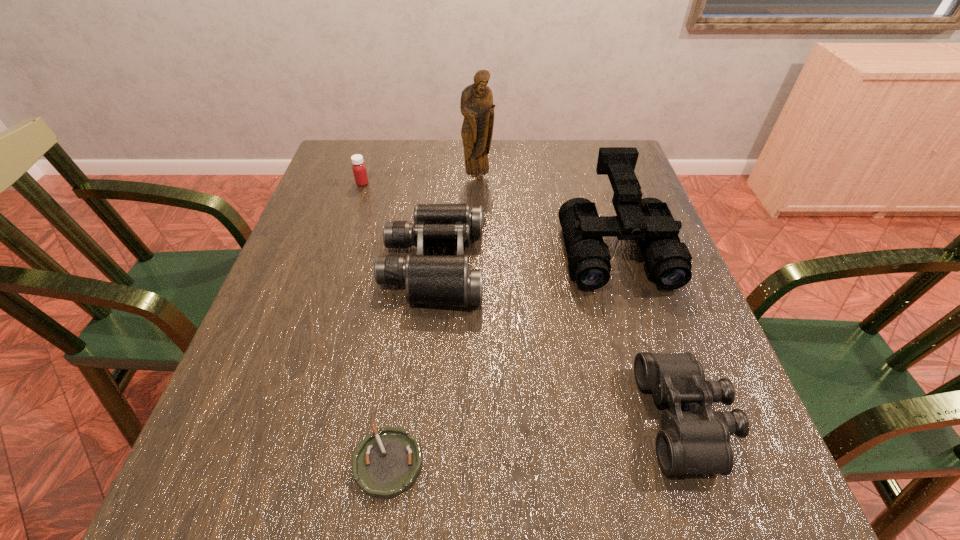
Locate an element on the screen. free point located on the right of the medicine is located at coordinates (478, 184).

Find the location of a particular element. This screenshot has width=960, height=540. free spot located 0.120m at the eyepieces of the nearest binoculars is located at coordinates (574, 418).

Find the location of `blank area located 0.340m at the eyepieces of the nearest binoculars`. blank area located 0.340m at the eyepieces of the nearest binoculars is located at coordinates (443, 418).

At what (x,y) coordinates should I click in order to perform the action: click on vacant space located 0.190m at the eyepieces of the nearest binoculars. Please return your answer as a coordinate pair (x, y). This screenshot has width=960, height=540. Looking at the image, I should click on (532, 418).

Where is `free space located on the right of the ashtray`? free space located on the right of the ashtray is located at coordinates (629, 463).

Where is `figurine located at the far edge`? figurine located at the far edge is located at coordinates (477, 107).

Find the location of a particular element. This screenshot has height=540, width=960. medicine at the far edge is located at coordinates (359, 169).

The image size is (960, 540). I want to click on binoculars at the near edge, so click(698, 442).

You are a GUI agent. You are given a task and a screenshot of the screen. Output one action in this format:
    pyautogui.click(x=<x>, y=<y>)
    Task: Click on the ashtray located at the near edge
    This screenshot has height=540, width=960.
    Given the screenshot: What is the action you would take?
    pyautogui.click(x=386, y=463)

Where is `object located in the left edge section of the desktop`? This screenshot has height=540, width=960. object located in the left edge section of the desktop is located at coordinates (359, 169).